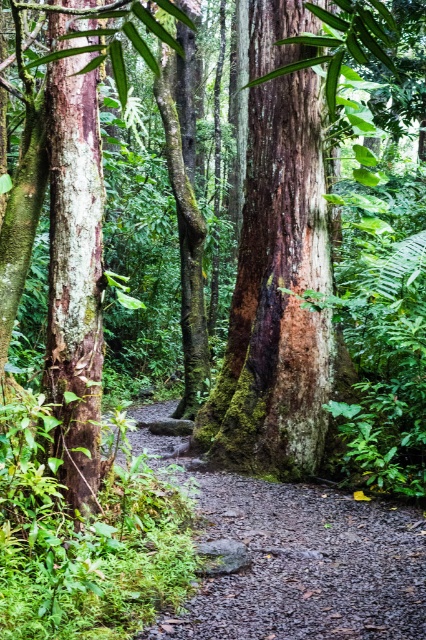
You are a hiker who wants to take a photo of both the smooth brown bark at center and the smooth bark tree trunk at left. Which tree should you stand closer to in order to capture both in a single frame?

You should stand closer to the smooth bark tree trunk at left because it is shorter than the smooth brown bark at center, allowing both to fit within the camera frame more easily.

You are a hiker walking along the damp gravel path at center. You want to touch the smooth brown bark at center. Can you reach it without stepping off the path?

The smooth brown bark at center is positioned over damp gravel path at center, so yes, you can reach it without stepping off the path.

You are a hiker carrying a 2.5 feet wide backpack. You need to walk along the damp gravel path at center while staying as close as possible to the smooth bark tree trunk at left. Is there enough space between them for your backpack?

The damp gravel path at center is 6.23 feet from the smooth bark tree trunk at left. Since your backpack is 2.5 feet wide, there is sufficient space between them for you to walk safely while staying close to the tree trunk.